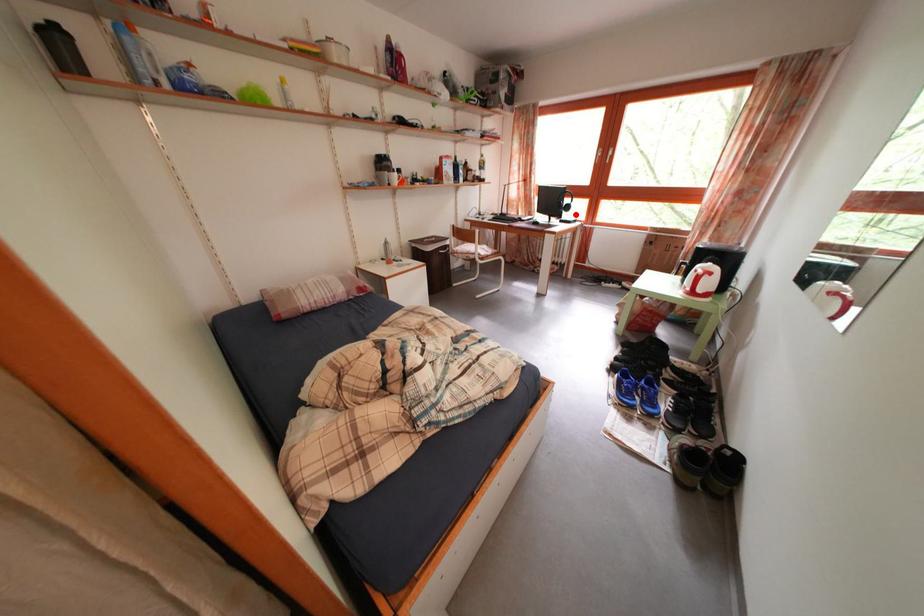
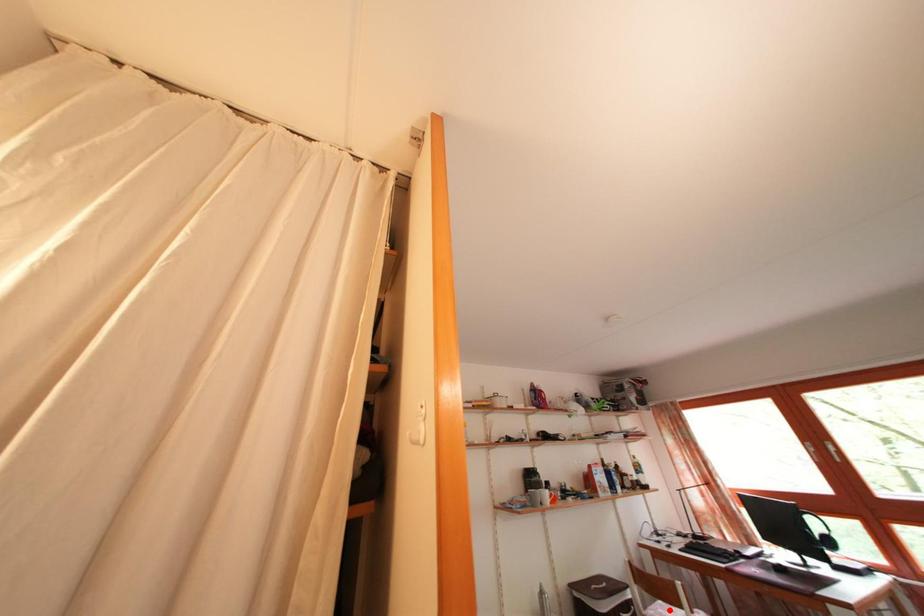
From the picture: I am providing you with two images of the same scene from different viewpoints. A red point is marked on the first image and another point is marked on the second image. Is the red point in image1 aligned with the point shown in image2?

No